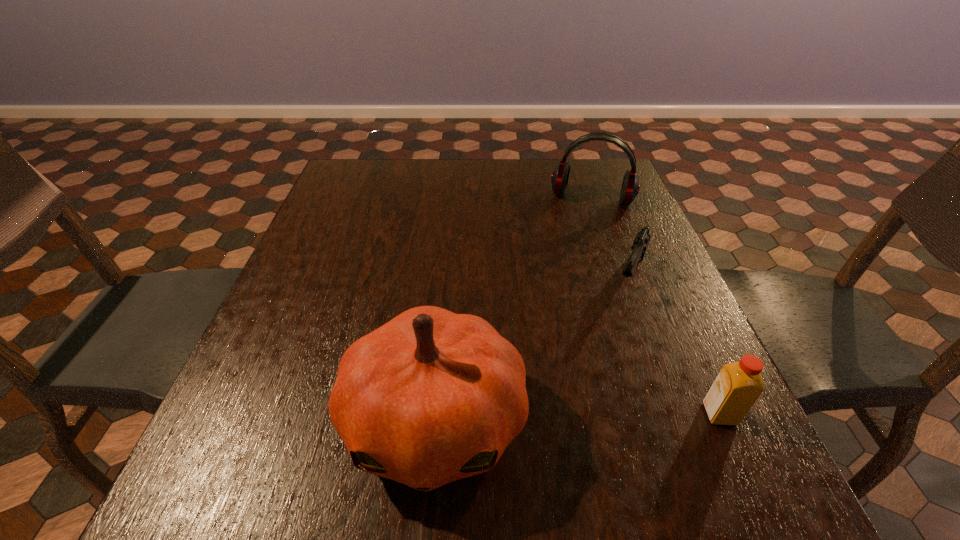
Where is `vacant area located on the ear cups of the third shortest object`? Image resolution: width=960 pixels, height=540 pixels. vacant area located on the ear cups of the third shortest object is located at coordinates (565, 286).

Locate an element on the screen. The image size is (960, 540). vacant region located 0.180m on the ear cups of the third shortest object is located at coordinates (574, 252).

In order to click on free point located 0.050m on the ear cups of the third shortest object in this screenshot , I will do `click(581, 223)`.

Where is `object that is at the far edge`? Image resolution: width=960 pixels, height=540 pixels. object that is at the far edge is located at coordinates (630, 187).

Locate an element on the screen. pumpkin positioned at the near edge is located at coordinates pyautogui.click(x=431, y=397).

In order to click on orange juice that is at the near edge in this screenshot , I will do `click(737, 387)`.

You are a GUI agent. You are given a task and a screenshot of the screen. Output one action in this format:
    pyautogui.click(x=<x>, y=<y>)
    Task: Click on the orange juice present at the right edge
    
    Given the screenshot: What is the action you would take?
    pyautogui.click(x=737, y=387)

Where is `gun that is at the right edge`? This screenshot has height=540, width=960. gun that is at the right edge is located at coordinates (642, 239).

Where is `earphone present at the right edge`? Image resolution: width=960 pixels, height=540 pixels. earphone present at the right edge is located at coordinates (630, 187).

In order to click on object that is at the far right corner in this screenshot , I will do `click(630, 187)`.